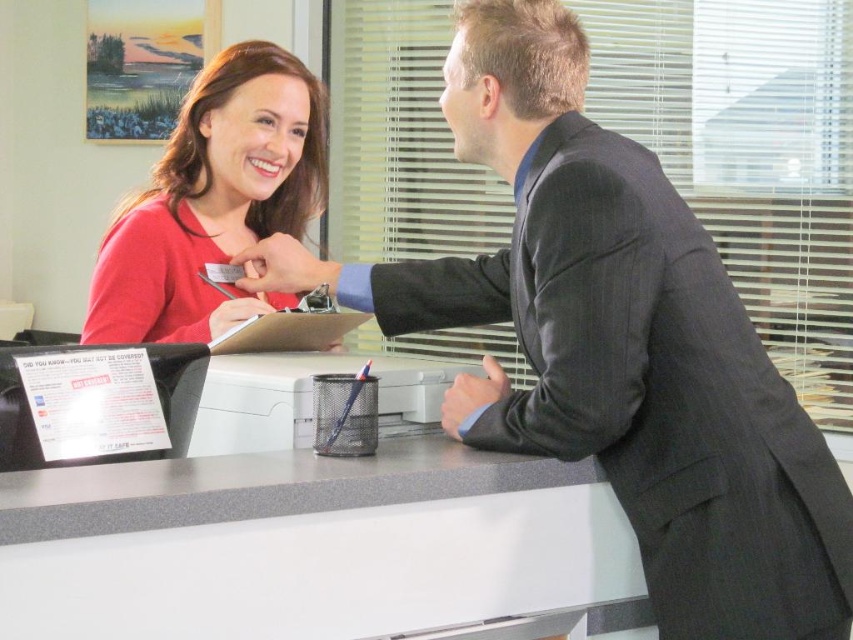
Question: Does black suit at center come in front of white laminate table at center?

Choices:
 (A) yes
 (B) no

Answer: (B)

Question: In this image, where is white laminate table at center located relative to matte black pen at center?

Choices:
 (A) above
 (B) below

Answer: (B)

Question: Which of the following is the closest to the observer?

Choices:
 (A) white laminate table at center
 (B) matte black pen at center

Answer: (A)

Question: Which point is farther from the camera taking this photo?

Choices:
 (A) (306, 285)
 (B) (553, 8)
 (C) (245, 307)
 (D) (102, 531)

Answer: (C)

Question: Does white laminate table at center have a larger size compared to matte black pen at center?

Choices:
 (A) yes
 (B) no

Answer: (A)

Question: Which of the following is the closest to the observer?

Choices:
 (A) satin black suit at center
 (B) metallic gray register at center
 (C) black suit at center
 (D) white laminate table at center

Answer: (D)